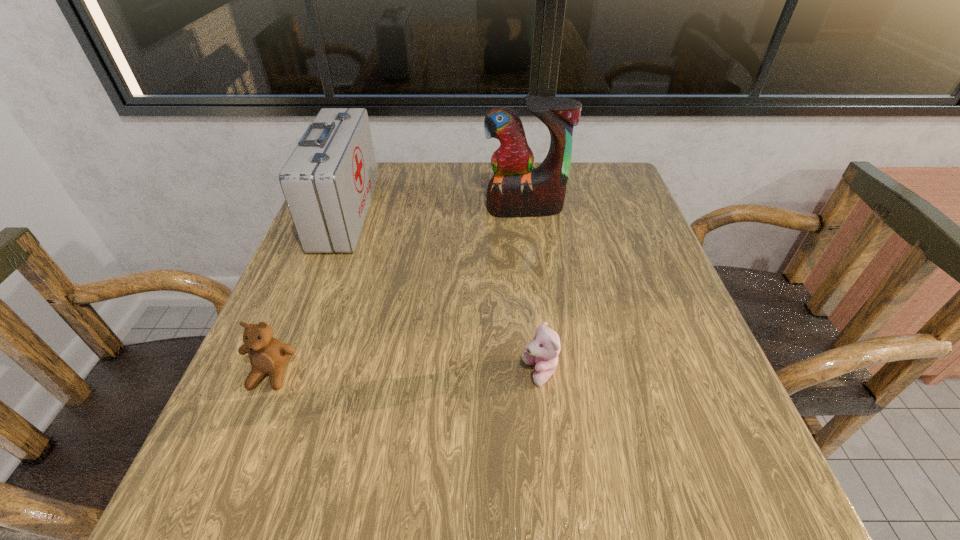
The height and width of the screenshot is (540, 960). Find the location of `parrot`. parrot is located at coordinates (516, 190).

Where is `the first-aid kit`? the first-aid kit is located at coordinates (328, 182).

Where is `the left teddy bear`? This screenshot has height=540, width=960. the left teddy bear is located at coordinates (268, 355).

Find the location of a particular element. This screenshot has width=960, height=540. the right teddy bear is located at coordinates (543, 350).

Locate an element on the screen. blank space located at the face of the parrot is located at coordinates (543, 348).

I want to click on free space located 0.110m on the front-facing side of the third shortest object, so click(415, 213).

I want to click on free space located 0.190m on the front-facing side of the left teddy bear, so click(x=208, y=527).

Identify the location of vacant region located 0.210m at the face of the right teddy bear. (391, 373).

What are the coordinates of `vacant space located at the face of the right teddy bear` in the screenshot? It's located at (366, 373).

Locate an element on the screen. vacant space located at the face of the right teddy bear is located at coordinates (304, 373).